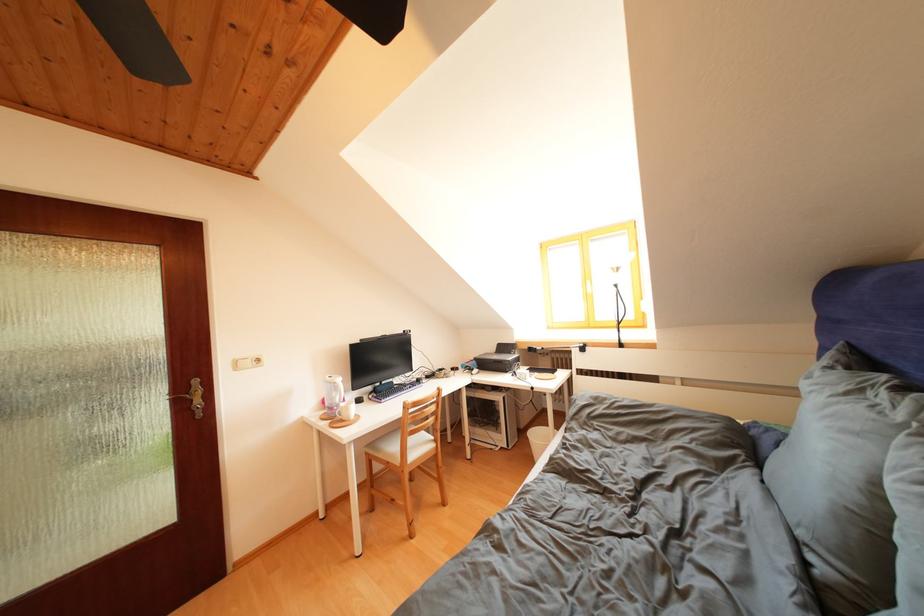
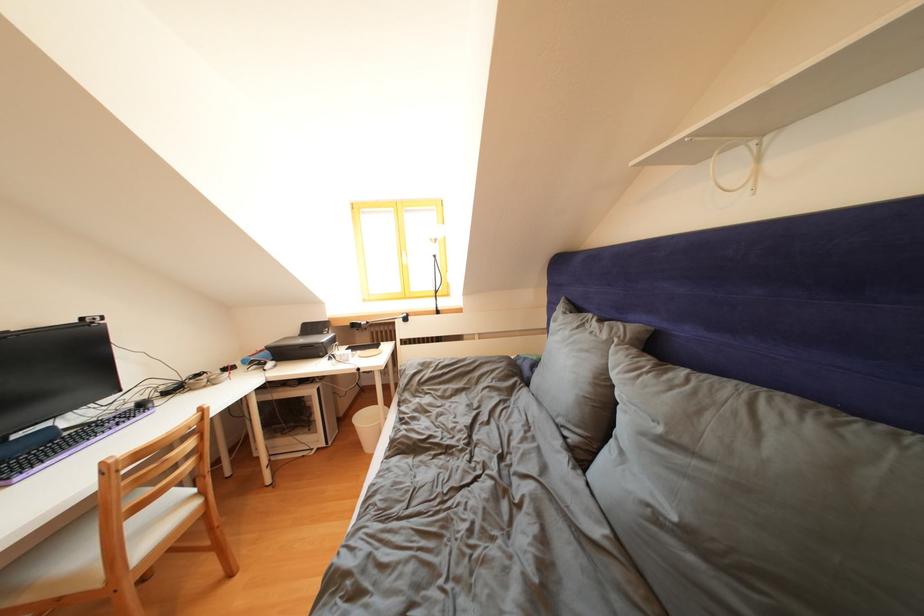
Locate, in the second image, the point that corresponds to (542,439) in the first image.

(371, 424)